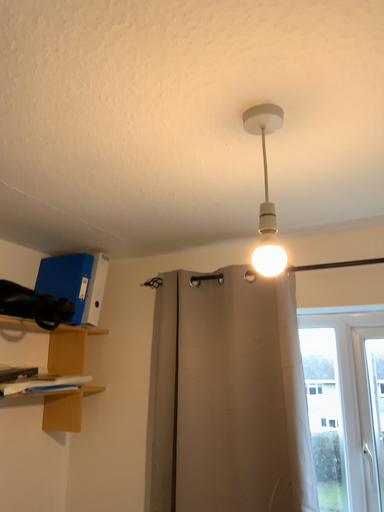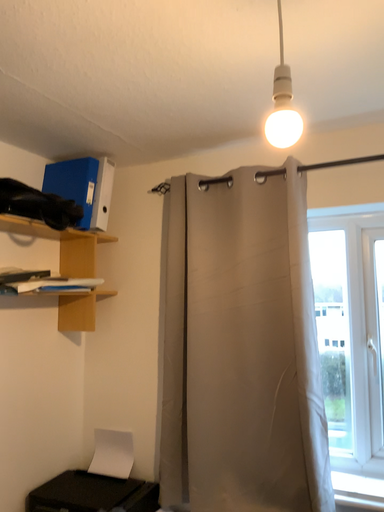
Question: How did the camera likely rotate when shooting the video?

Choices:
 (A) rotated upward
 (B) rotated downward

Answer: (B)